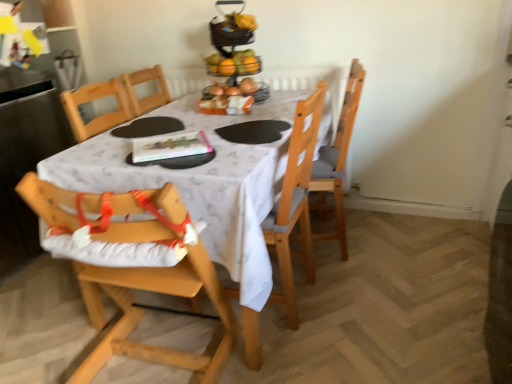
Identify the location of vacant space to the left of wooden highchair at lower left, the third chair when ordered from right to left. The width and height of the screenshot is (512, 384). pyautogui.click(x=57, y=342).